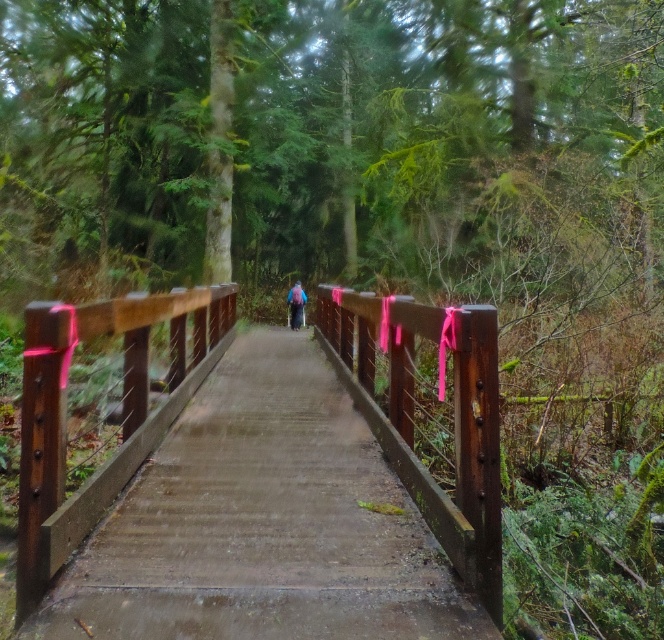
Question: Can you confirm if rustic wood bridge at center is wider than purple fabric backpack at center?

Choices:
 (A) yes
 (B) no

Answer: (B)

Question: Is rustic wood bridge at center in front of purple fabric backpack at center?

Choices:
 (A) yes
 (B) no

Answer: (A)

Question: Which point appears closest to the camera in this image?

Choices:
 (A) (501, 563)
 (B) (297, 316)

Answer: (A)

Question: Can you confirm if rustic wood bridge at center is positioned below purple fabric backpack at center?

Choices:
 (A) no
 (B) yes

Answer: (B)

Question: Which of the following is the closest to the observer?

Choices:
 (A) purple fabric backpack at center
 (B) rustic wood bridge at center

Answer: (B)